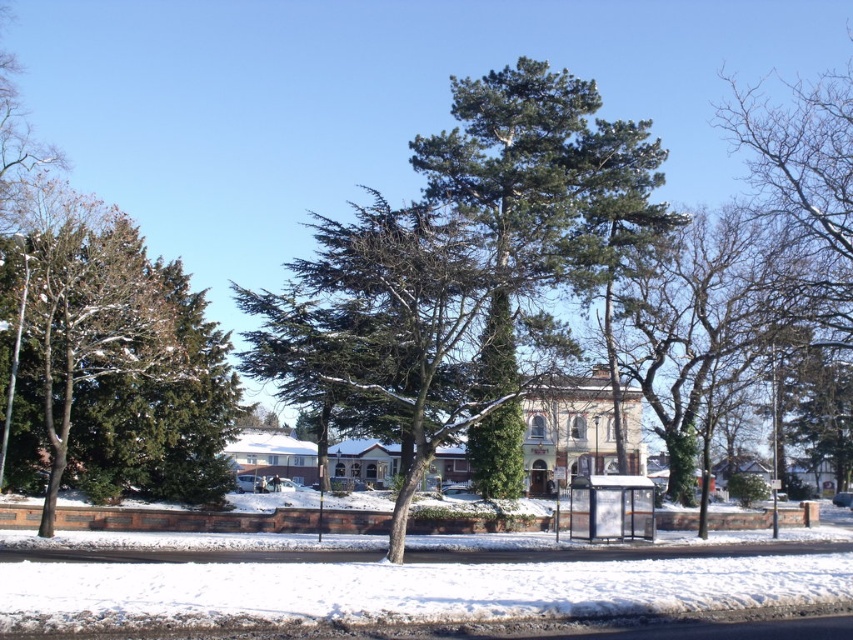
Question: Does green needle-like at center appear on the right side of transparent plastic bus stop at center?

Choices:
 (A) yes
 (B) no

Answer: (A)

Question: Can you confirm if green needle-like tree at center is thinner than transparent plastic bus stop at center?

Choices:
 (A) no
 (B) yes

Answer: (A)

Question: Is white powdery snow at lower center below green needle-like tree at center?

Choices:
 (A) yes
 (B) no

Answer: (A)

Question: Which object is positioned closest to the transparent plastic bus stop at center?

Choices:
 (A) green textured tree at left
 (B) white powdery snow at lower center
 (C) green needle-like tree at center
 (D) green needle-like at center

Answer: (C)

Question: Which point appears closest to the camera in this image?

Choices:
 (A) (723, 266)
 (B) (672, 221)

Answer: (B)

Question: Which object is the closest to the transparent plastic bus stop at center?

Choices:
 (A) green textured tree at left
 (B) green needle-like tree at center

Answer: (B)